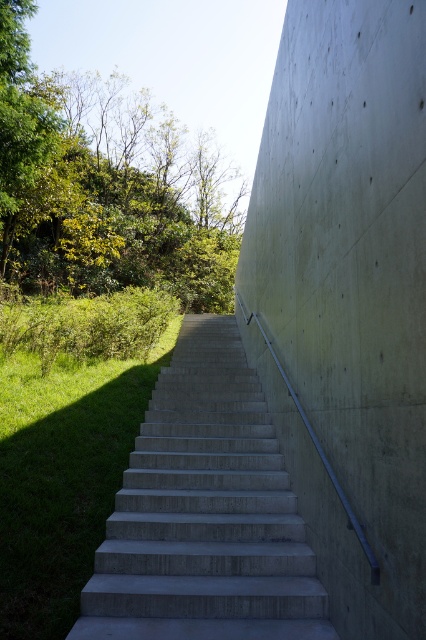
Does point (336, 36) come closer to viewer compared to point (52, 125)?

Yes, point (336, 36) is closer to viewer.

Does smooth concrete stairs at center appear under green leafy tree at upper left?

Correct, smooth concrete stairs at center is located below green leafy tree at upper left.

You are a GUI agent. You are given a task and a screenshot of the screen. Output one action in this format:
    pyautogui.click(x=<x>, y=<y>)
    Task: Click on the smooth concrete stairs at center
    
    Given the screenshot: What is the action you would take?
    pyautogui.click(x=345, y=298)

Does concrete stairs at center appear on the left side of green grass at lower left?

No, concrete stairs at center is not to the left of green grass at lower left.

Is concrete stairs at center closer to camera compared to green grass at lower left?

No.

Is point (229, 356) behind point (106, 486)?

Yes, it is.

The height and width of the screenshot is (640, 426). I want to click on concrete stairs at center, so click(x=204, y=513).

Which is above, green leafy tree at upper left or green grass at lower left?

Positioned higher is green leafy tree at upper left.

Measure the distance between point (206,266) and camera.

Point (206,266) is 20.11 meters from camera.

Locate an element on the screen. The width and height of the screenshot is (426, 640). green leafy tree at upper left is located at coordinates (106, 186).